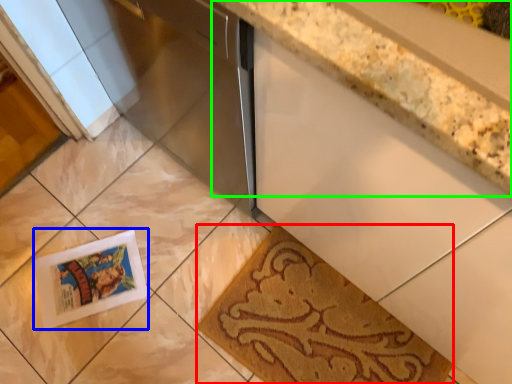
Question: Estimate the real-world distances between objects in this image. Which object is farther from mat (highlighted by a red box), postcard (highlighted by a blue box) or countertop (highlighted by a green box)?

Choices:
 (A) postcard
 (B) countertop

Answer: (B)